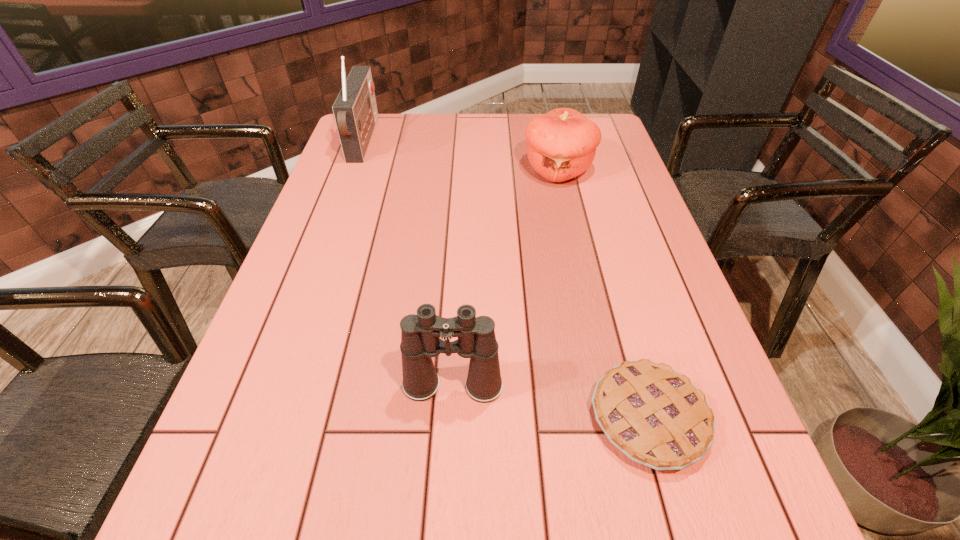
What are the coordinates of `object positioned at the far edge` in the screenshot? It's located at (355, 111).

Image resolution: width=960 pixels, height=540 pixels. Identify the location of object located in the left edge section of the desktop. (355, 111).

The width and height of the screenshot is (960, 540). In order to click on pumpkin located at the right edge in this screenshot , I will do `click(561, 144)`.

Locate an element on the screen. The image size is (960, 540). pie at the right edge is located at coordinates (657, 417).

Find the location of a particular element. object that is positioned at the far left corner is located at coordinates (355, 111).

Locate an element on the screen. The height and width of the screenshot is (540, 960). free location at the far edge is located at coordinates (404, 130).

In the image, there is a desktop. Identify the location of vacant space at the near edge. (399, 517).

Identify the location of vacant point at the left edge. The height and width of the screenshot is (540, 960). (333, 222).

Locate an element on the screen. The image size is (960, 540). blank space at the right edge of the desktop is located at coordinates (742, 429).

The height and width of the screenshot is (540, 960). I want to click on vacant point located between the third shortest object and the radio receiver, so (408, 264).